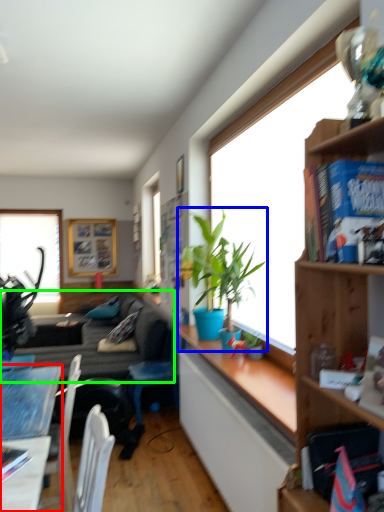
Question: Which object is positioned closest to desk (highlighted by a red box)? Select from houseplant (highlighted by a blue box) and studio couch (highlighted by a green box).

Choices:
 (A) houseplant
 (B) studio couch

Answer: (A)